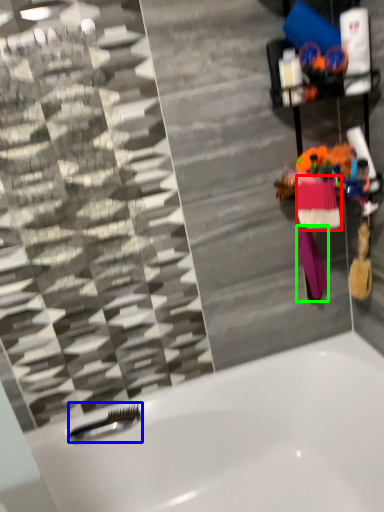
Question: Which object is the farthest from clothing (highlighted by a red box)? Choose among these: shower (highlighted by a blue box) or clothing (highlighted by a green box).

Choices:
 (A) shower
 (B) clothing

Answer: (A)